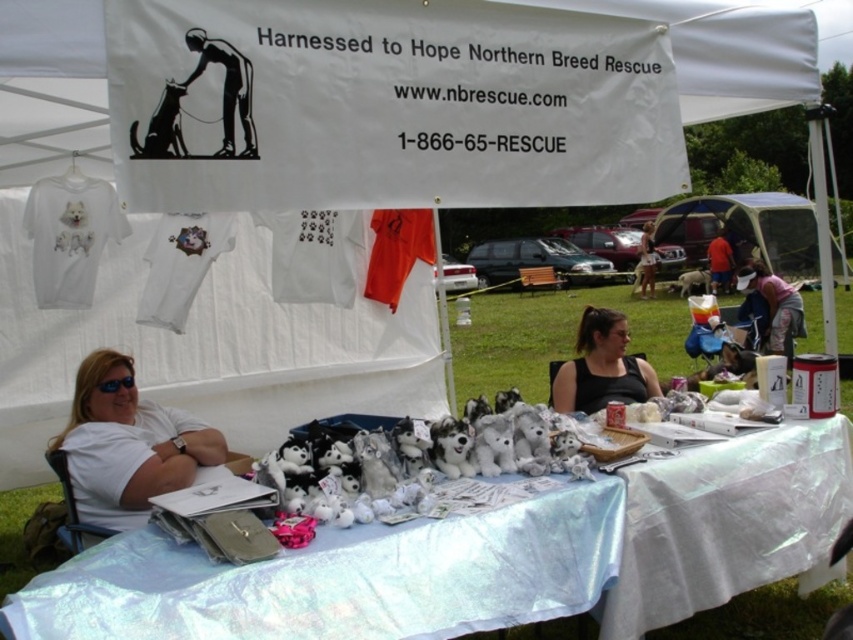
You are a volunteer at the Northern Breed Rescue event. You see a person with light brown hair at center and a white plush dog at center. Which object is on the left side?

The light brown hair at center is positioned on the left side of the white plush dog at center.

You are organizing an event and need to place a small sign on the table in front of the black fabric at center and the white plush dog at center. Where should you place the sign so it is visible to attendees passing by both objects?

The sign should be placed in front of both the black fabric at center and the white plush dog at center, since the black fabric at center is below the white plush dog at center, the sign can be placed in front of the white plush dog at center to be visible to attendees passing by both objects.

From the picture: You are organizing an event booth and need to place a new sign above the black fabric at center and the white plush dog at center. Which object should the sign be placed above to ensure it is visible from a distance?

The sign should be placed above the white plush dog at center because it is larger in size compared to the black fabric at center, making it a better reference point for visibility.